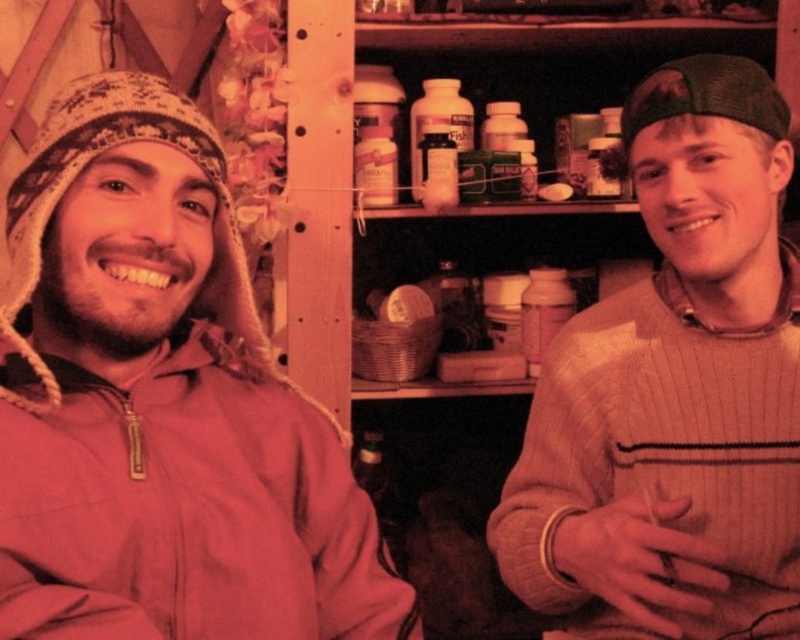
Question: Estimate the real-world distances between objects in this image. Which object is farther from the green fabric cap at upper right?

Choices:
 (A) knitted sweater at right
 (B) matte pink jacket at left

Answer: (B)

Question: Does knitted sweater at right lie behind green fabric cap at upper right?

Choices:
 (A) no
 (B) yes

Answer: (A)

Question: Does matte pink jacket at left have a smaller size compared to green fabric cap at upper right?

Choices:
 (A) no
 (B) yes

Answer: (A)

Question: Based on their relative distances, which object is farther from the green fabric cap at upper right?

Choices:
 (A) matte pink jacket at left
 (B) knitted sweater at right

Answer: (A)

Question: Considering the relative positions of matte pink jacket at left and knitted sweater at right in the image provided, where is matte pink jacket at left located with respect to knitted sweater at right?

Choices:
 (A) above
 (B) below

Answer: (B)

Question: Among these points, which one is nearest to the camera?

Choices:
 (A) (754, 109)
 (B) (322, 532)
 (C) (698, 64)

Answer: (B)